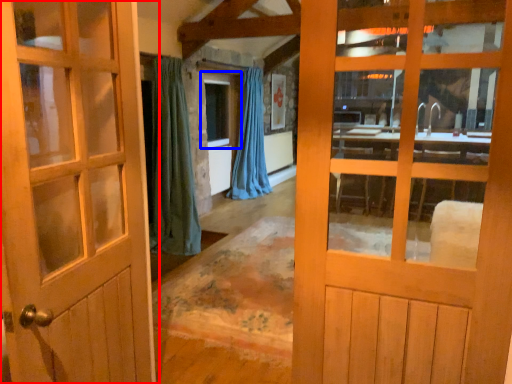
Question: Which point is closer to the camera, door (highlighted by a red box) or window (highlighted by a blue box)?

Choices:
 (A) door
 (B) window

Answer: (A)